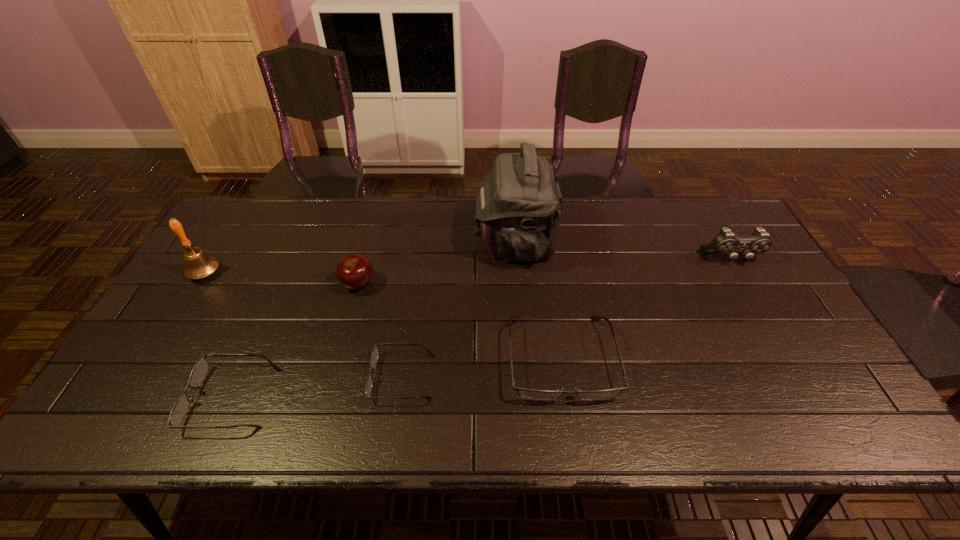
Where is `free space between the shortest object and the leftmost object`? free space between the shortest object and the leftmost object is located at coordinates (304, 325).

The image size is (960, 540). What are the coordinates of `vacant area that lies between the sixth shortest object and the second object from left to right` in the screenshot? It's located at (219, 336).

Select which object is the fourth closest to the control. Please provide its 2D coordinates. Your answer should be formatted as a tuple, i.e. [(x, y)], where the tuple contains the x and y coordinates of a point satisfying the conditions above.

[(354, 272)]

Locate an element on the screen. This screenshot has width=960, height=540. the second closest object to the apple is located at coordinates (180, 409).

Where is `spectacles that is the closest one to the leftmost spectacles`? The height and width of the screenshot is (540, 960). spectacles that is the closest one to the leftmost spectacles is located at coordinates (374, 357).

At what (x,y) coordinates should I click in order to perform the action: click on the closest spectacles to the leftmost spectacles. Please return your answer as a coordinate pair (x, y). The height and width of the screenshot is (540, 960). Looking at the image, I should click on (374, 357).